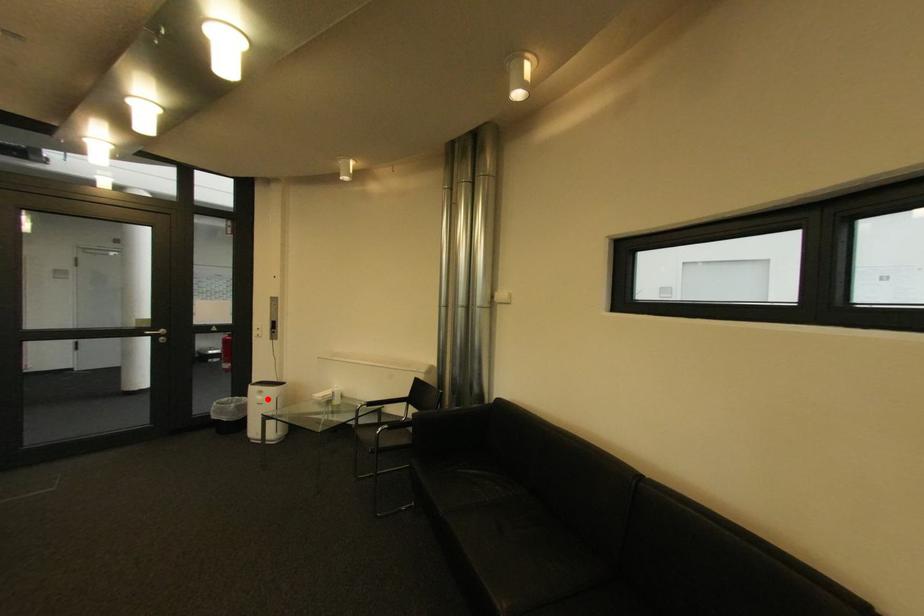
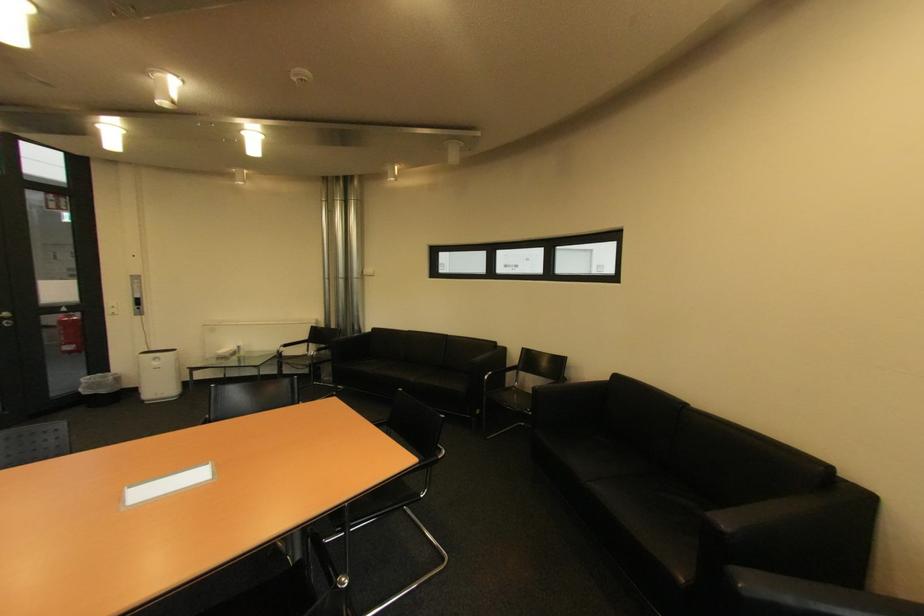
Locate, in the second image, the point that corresponds to the highlighted location in the first image.

(164, 363)